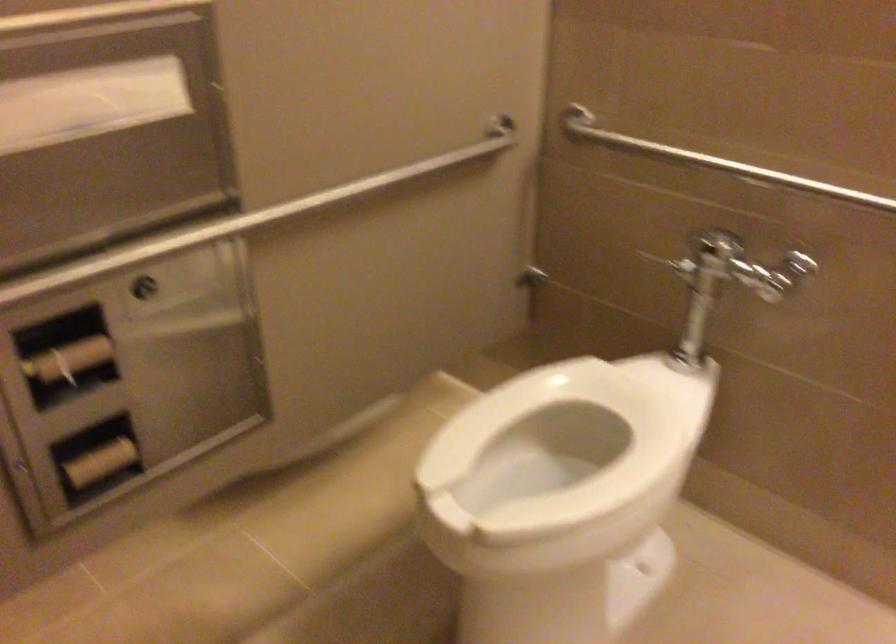
The width and height of the screenshot is (896, 644). In order to click on white toilet seat in this screenshot , I will do `click(563, 431)`.